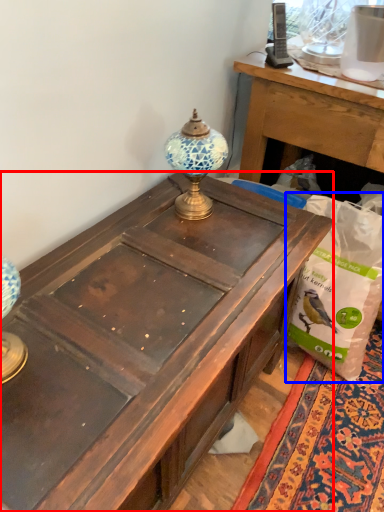
Question: Which object is closer to the camera taking this photo, desk (highlighted by a red box) or paper bag (highlighted by a blue box)?

Choices:
 (A) desk
 (B) paper bag

Answer: (A)